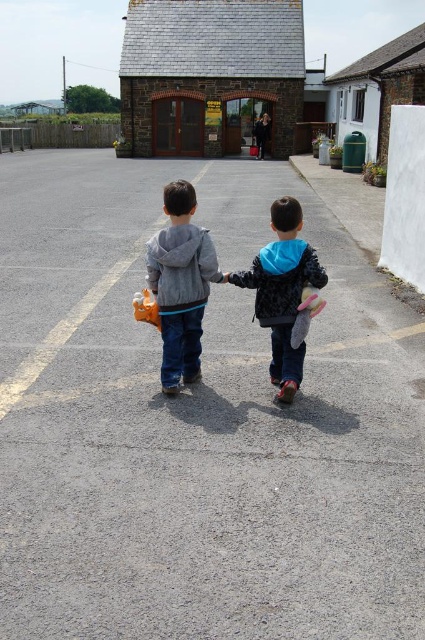
Question: Does blue fleece jacket at center come behind orange rubber duck at center?

Choices:
 (A) yes
 (B) no

Answer: (B)

Question: Which point is closer to the camera?

Choices:
 (A) gray fleece hoodie at center
 (B) blue fleece jacket at center
 (C) pink fabric toy at center

Answer: (C)

Question: Which object appears closest to the camera in this image?

Choices:
 (A) orange rubber duck at center
 (B) gray fleece hoodie at center
 (C) blue fleece jacket at center

Answer: (C)

Question: Does pink fabric toy at center have a greater width compared to orange rubber duck at center?

Choices:
 (A) no
 (B) yes

Answer: (B)

Question: Among these objects, which one is farthest from the camera?

Choices:
 (A) gray fleece hoodie at center
 (B) orange rubber duck at center
 (C) blue fleece jacket at center

Answer: (B)

Question: Can you confirm if gray fleece hoodie at center is positioned above pink fabric toy at center?

Choices:
 (A) no
 (B) yes

Answer: (B)